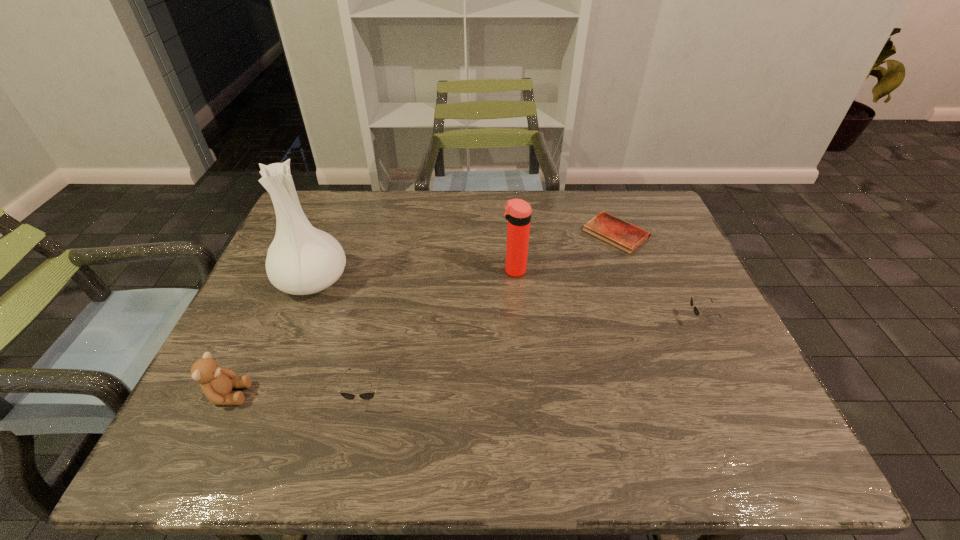
Please point a space for a new sunglasses to maintain equal intervals. Please provide its 2D coordinates. Your answer should be formatted as a tuple, i.e. [(x, y)], where the tuple contains the x and y coordinates of a point satisfying the conditions above.

[(545, 355)]